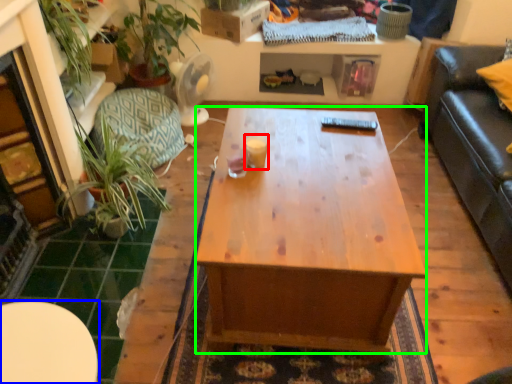
Question: Which object is the farthest from coffee cup (highlighted by a red box)? Choose among these: table (highlighted by a blue box) or desk (highlighted by a green box).

Choices:
 (A) table
 (B) desk

Answer: (A)